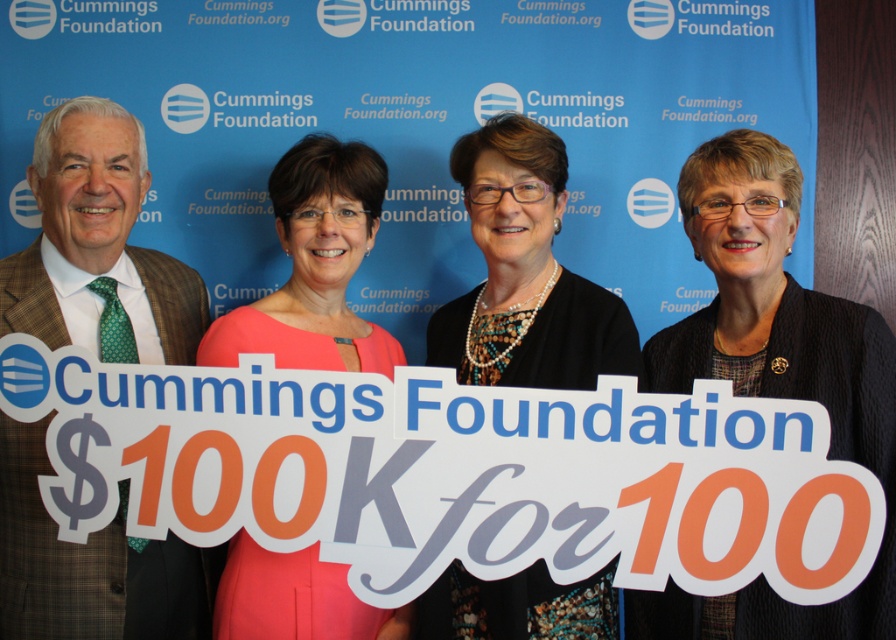
Is green textured tie at left to the left of pearl necklace at center from the viewer's perspective?

Correct, you'll find green textured tie at left to the left of pearl necklace at center.

Between green textured tie at left and pearl necklace at center, which one is positioned higher?

Positioned higher is pearl necklace at center.

Is point (55, 157) closer to viewer compared to point (597, 572)?

No, it is not.

At what (x,y) coordinates should I click in order to perform the action: click on green textured tie at left. Please return your answer as a coordinate pair (x, y). The image size is (896, 640). Looking at the image, I should click on (98, 248).

Can you confirm if pearl necklace at center is positioned to the right of pink satin dress at center?

Yes, pearl necklace at center is to the right of pink satin dress at center.

Does pearl necklace at center have a smaller size compared to pink satin dress at center?

Incorrect, pearl necklace at center is not smaller in size than pink satin dress at center.

Does point (442, 360) lie in front of point (239, 332)?

No, (442, 360) is further to viewer.

This screenshot has height=640, width=896. I want to click on pearl necklace at center, so click(x=524, y=273).

Is green textured tie at left to the right of pink satin dress at center from the viewer's perspective?

Incorrect, green textured tie at left is not on the right side of pink satin dress at center.

Where is `green textured tie at left`? Image resolution: width=896 pixels, height=640 pixels. green textured tie at left is located at coordinates (98, 248).